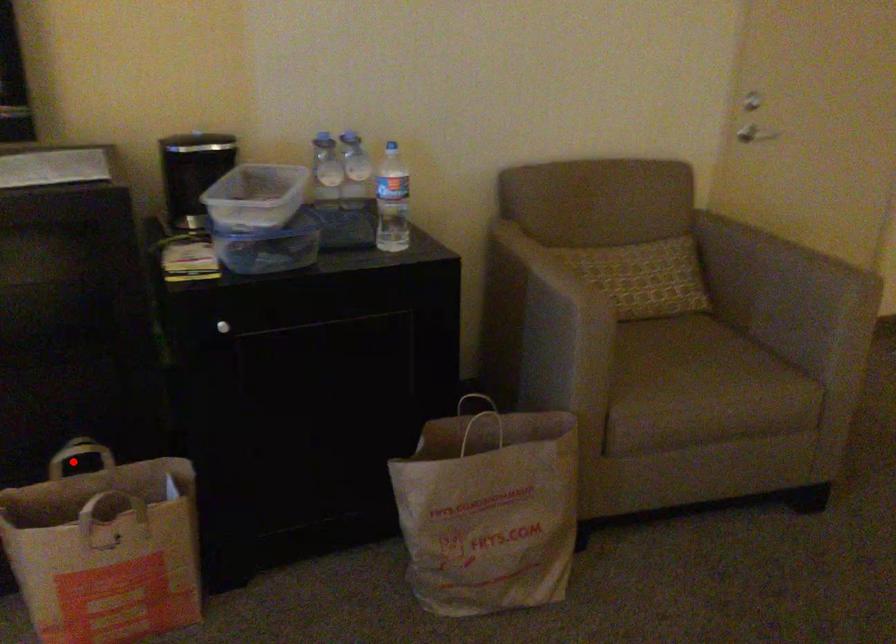
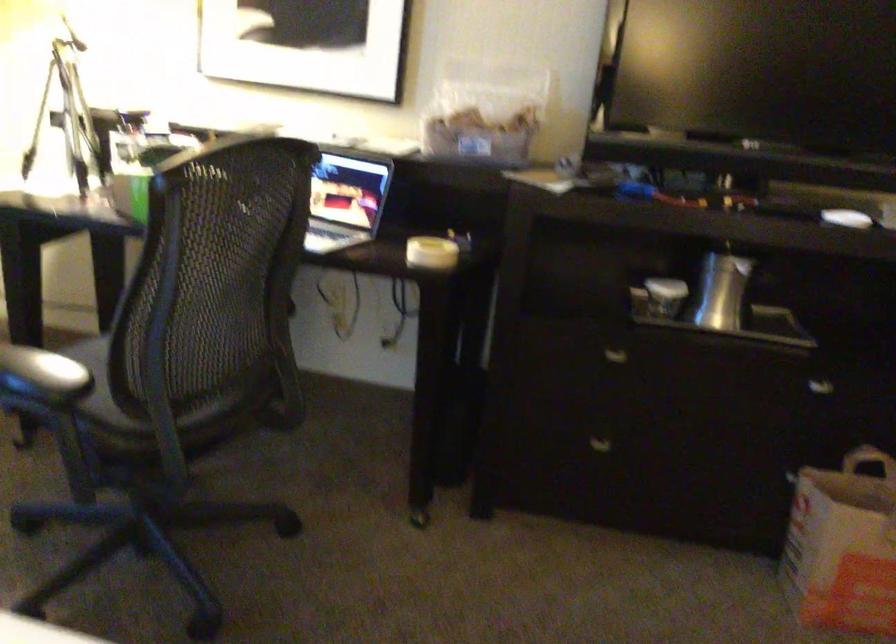
Find the pixel in the second image that matches the highlighted location in the first image.

(867, 460)